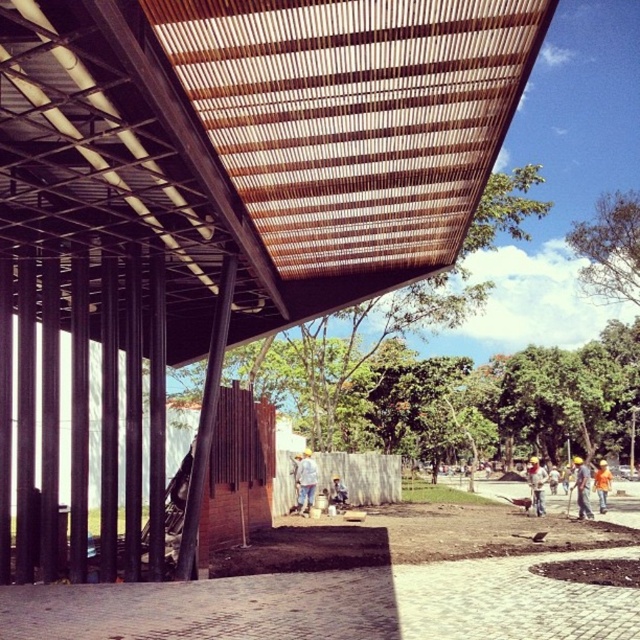
Question: Can you confirm if white fabric shirt at center is thinner than denim jacket at lower right?

Choices:
 (A) no
 (B) yes

Answer: (B)

Question: Which is farther from the white fabric shirt at center?

Choices:
 (A) yellow hard hat at lower right
 (B) blue denim jeans at center
 (C) brown corrugated metal roof at upper center

Answer: (C)

Question: Does white fabric shirt at center have a greater width compared to blue denim jeans at center?

Choices:
 (A) no
 (B) yes

Answer: (B)

Question: Is yellow hard hat at lower right bigger than orange fabric at lower right?

Choices:
 (A) yes
 (B) no

Answer: (B)

Question: Which point is closer to the camera taking this photo?

Choices:
 (A) (268, 76)
 (B) (595, 472)
 (C) (545, 472)
 (D) (307, 500)

Answer: (A)

Question: Which object is positioned closest to the orange fabric at lower right?

Choices:
 (A) brown corrugated metal roof at upper center
 (B) white fabric shirt at center
 (C) yellow hard hat at lower right

Answer: (C)